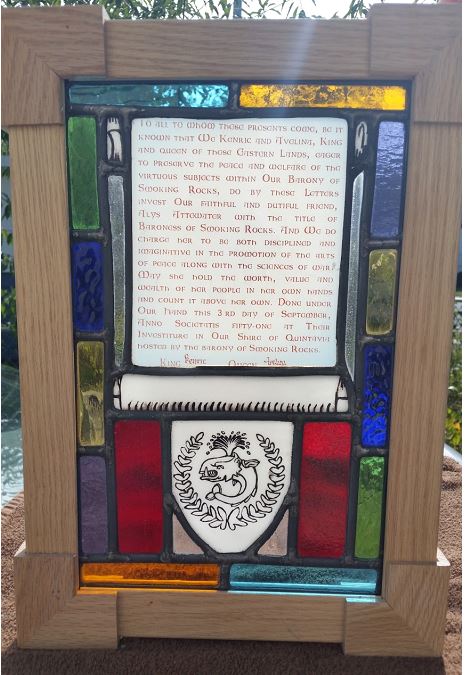
Where is `frame`? The image size is (465, 675). frame is located at coordinates (423, 451).